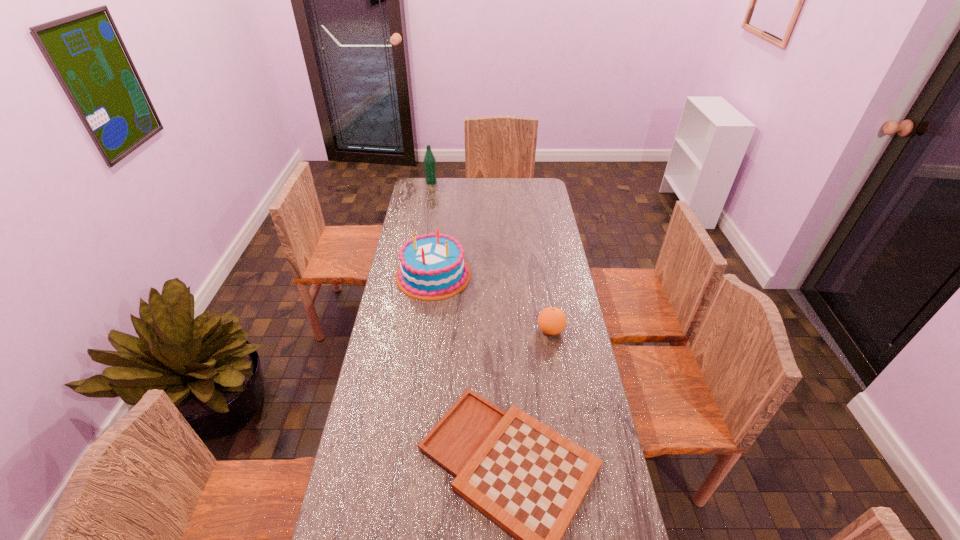
You are a GUI agent. You are given a task and a screenshot of the screen. Output one action in this format:
    pyautogui.click(x=<x>, y=<y>)
    Task: Click on the object located in the right edge section of the desktop
    
    Given the screenshot: What is the action you would take?
    pyautogui.click(x=552, y=321)

I want to click on object at the far left corner, so click(429, 160).

You are a GUI agent. You are given a task and a screenshot of the screen. Output one action in this format:
    pyautogui.click(x=<x>, y=<y>)
    Task: Click on the free space at the far edge of the desktop
    This screenshot has height=540, width=960.
    Given the screenshot: What is the action you would take?
    pyautogui.click(x=448, y=190)

Locate an element on the screen. This screenshot has width=960, height=540. vacant region at the left edge of the desktop is located at coordinates click(x=362, y=525).

Identify the location of free space at the right edge of the desktop. (552, 280).

The width and height of the screenshot is (960, 540). I want to click on blank area at the far left corner, so click(437, 182).

Find the location of a particular element. This screenshot has height=540, width=960. vacant space in between the bottle and the birthday cake is located at coordinates (432, 228).

Where is `free area in between the farthest object and the second shortest object`? The image size is (960, 540). free area in between the farthest object and the second shortest object is located at coordinates (491, 256).

Find the location of a particular element. empty space between the second shortest object and the birthday cake is located at coordinates (492, 302).

The width and height of the screenshot is (960, 540). I want to click on blank region between the farthest object and the third nearest object, so click(x=432, y=228).